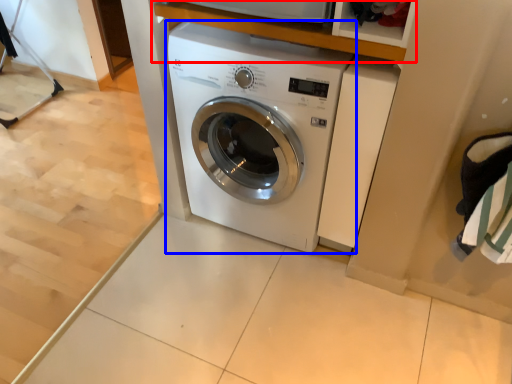
Question: Which object appears closest to the camera in this image, shelf (highlighted by a red box) or washing machine (highlighted by a blue box)?

Choices:
 (A) shelf
 (B) washing machine

Answer: (A)